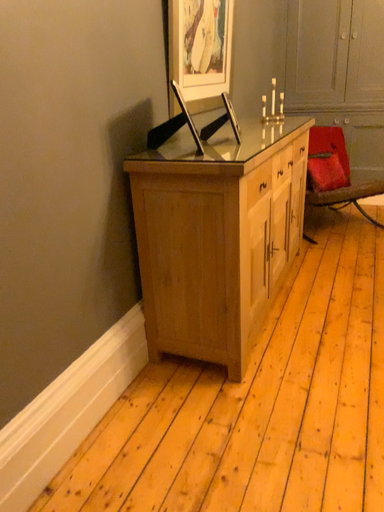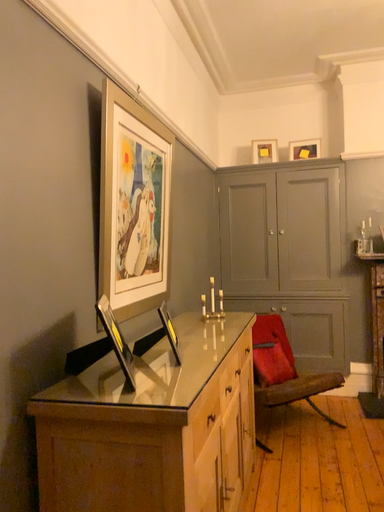
Question: How did the camera likely rotate when shooting the video?

Choices:
 (A) rotated downward
 (B) rotated upward

Answer: (B)